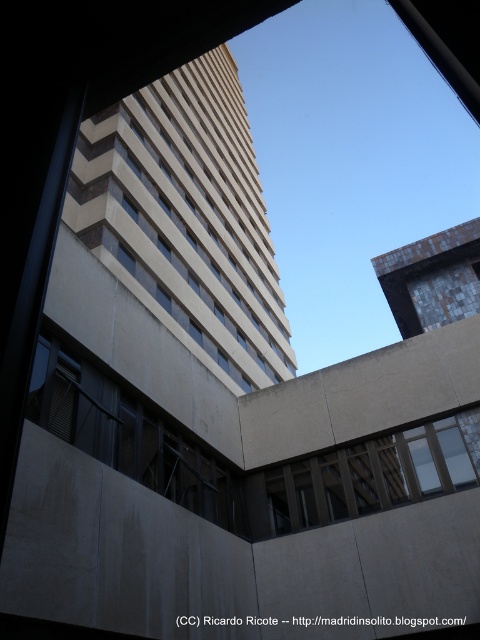
Between beige concrete building at upper center and brown wooden window at center, which one appears on the left side from the viewer's perspective?

beige concrete building at upper center

Can you confirm if beige concrete building at upper center is positioned to the left of brown wooden window at center?

Indeed, beige concrete building at upper center is positioned on the left side of brown wooden window at center.

Is point (196, 214) positioned behind point (335, 513)?

Yes, point (196, 214) is behind point (335, 513).

At what (x,y) coordinates should I click in order to perform the action: click on beige concrete building at upper center. Please return your answer as a coordinate pair (x, y). This screenshot has height=640, width=480. Looking at the image, I should click on (187, 218).

Is point (140, 230) more distant than point (67, 413)?

Yes.

Where is `beige concrete building at upper center`? This screenshot has width=480, height=640. beige concrete building at upper center is located at coordinates (187, 218).

Is point (192, 125) positioned behind point (240, 531)?

That is True.

The image size is (480, 640). What are the coordinates of `beige concrete building at upper center` in the screenshot? It's located at (187, 218).

Which is more to the left, matte concrete window at lower left or brown wooden window at center?

matte concrete window at lower left is more to the left.

Does matte concrete window at lower left appear on the right side of brown wooden window at center?

In fact, matte concrete window at lower left is to the left of brown wooden window at center.

Between point (170, 448) and point (277, 486), which one is positioned behind?

The point (277, 486) is more distant.

At what (x,y) coordinates should I click in order to perform the action: click on matte concrete window at lower left. Please return your answer as a coordinate pair (x, y). Looking at the image, I should click on (129, 435).